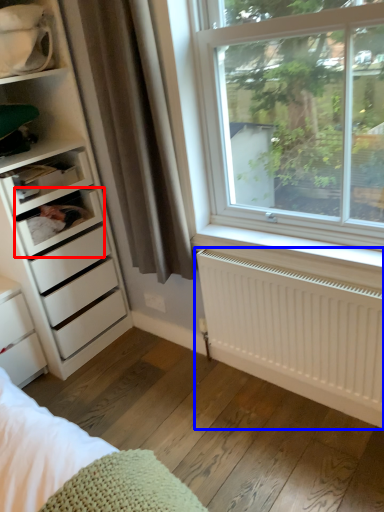
Question: Which of the following is the farthest to the observer, shelf (highlighted by a red box) or radiator (highlighted by a blue box)?

Choices:
 (A) shelf
 (B) radiator

Answer: (A)